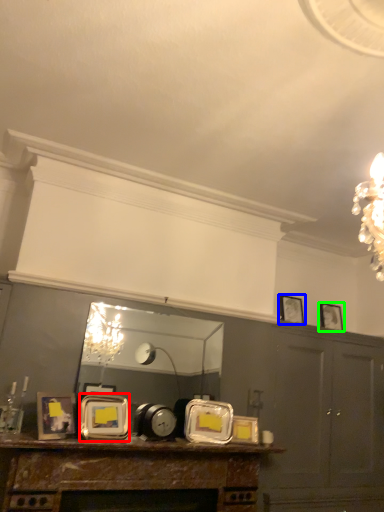
Question: Estimate the real-world distances between objects in this image. Which object is closer to picture frame (highlighted by a red box), picture frame (highlighted by a blue box) or picture frame (highlighted by a green box)?

Choices:
 (A) picture frame
 (B) picture frame

Answer: (A)